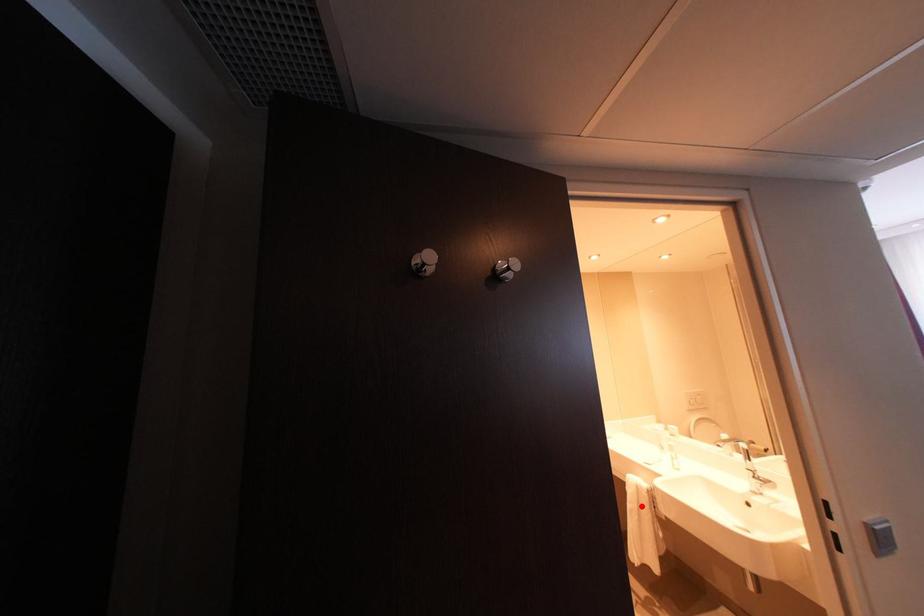
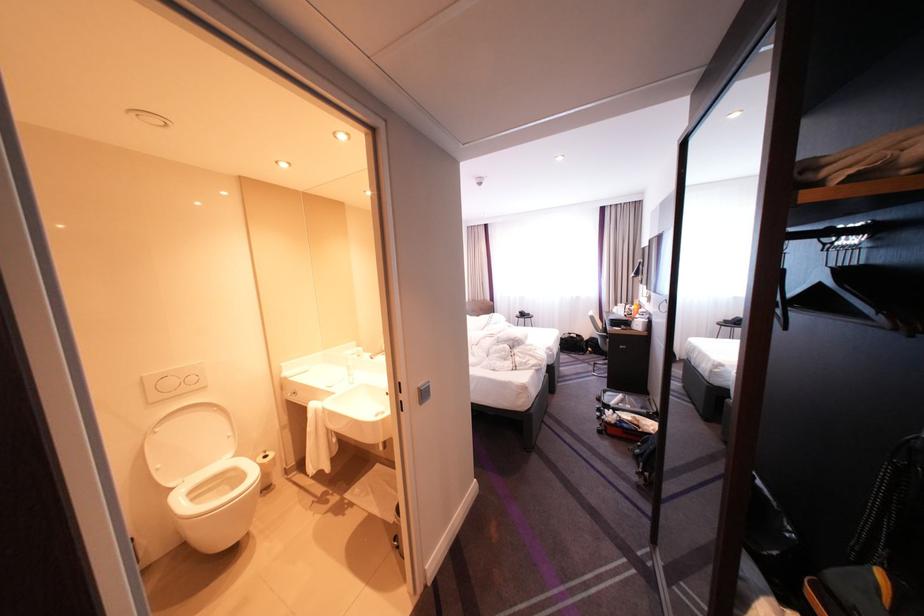
Question: A red point is marked in image1. In image2, is the corresponding 3D point closer to the camera or farther? Reply with the corresponding letter.

Choices:
 (A) The corresponding 3D point is closer.
 (B) The corresponding 3D point is farther.

Answer: (B)